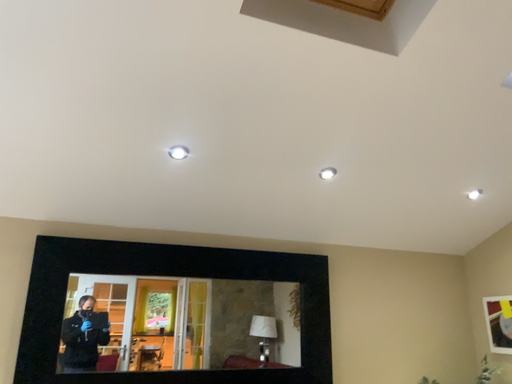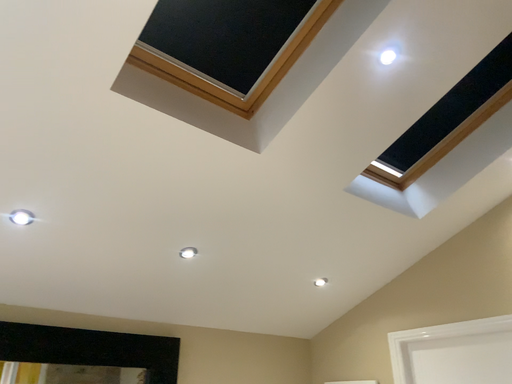
Question: Which way did the camera rotate in the video?

Choices:
 (A) rotated downward
 (B) rotated upward

Answer: (B)